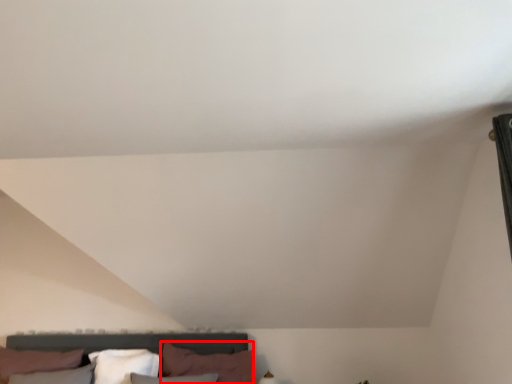
Question: From the image's perspective, what is the correct spatial positioning of pillow (annotated by the red box) in reference to pillow?

Choices:
 (A) above
 (B) below

Answer: (A)